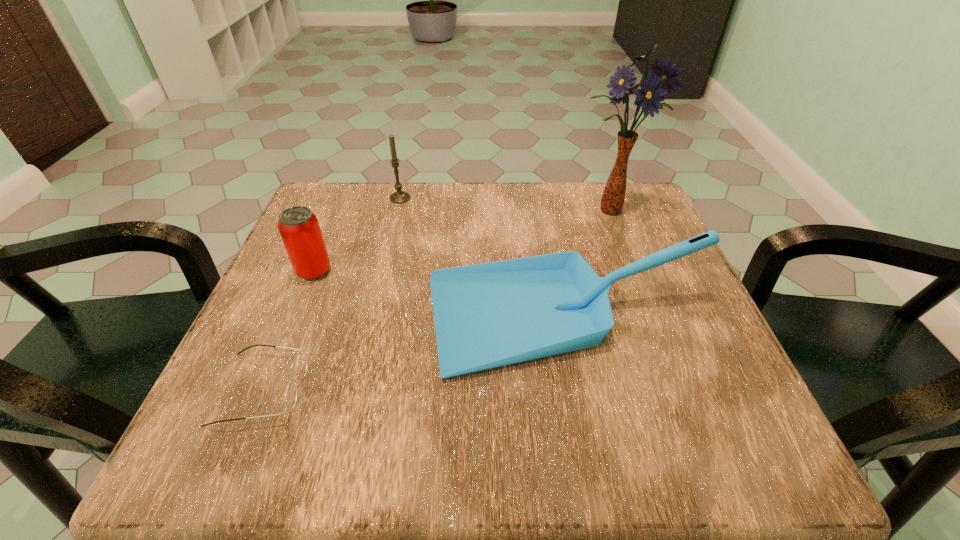
Where is `flower arrangement that is at the far edge`? The width and height of the screenshot is (960, 540). flower arrangement that is at the far edge is located at coordinates (649, 97).

Where is `candle present at the far edge`? The height and width of the screenshot is (540, 960). candle present at the far edge is located at coordinates (399, 196).

Where is `object that is at the near edge`? The image size is (960, 540). object that is at the near edge is located at coordinates (291, 393).

Locate an element on the screen. can that is at the left edge is located at coordinates (299, 228).

Image resolution: width=960 pixels, height=540 pixels. Identify the location of spectacles present at the left edge. (291, 393).

You are a GUI agent. You are given a task and a screenshot of the screen. Output one action in this format:
    pyautogui.click(x=<x>, y=<y>)
    Task: Click on the flower arrangement situated at the right edge
    The height and width of the screenshot is (540, 960).
    Given the screenshot: What is the action you would take?
    (649, 97)

I want to click on dustpan positioned at the right edge, so click(487, 315).

The width and height of the screenshot is (960, 540). What are the coordinates of `object at the near left corner` in the screenshot? It's located at (291, 393).

You are a GUI agent. You are given a task and a screenshot of the screen. Output one action in this format:
    pyautogui.click(x=<x>, y=<y>)
    Task: Click on the object that is at the far right corner
    The width and height of the screenshot is (960, 540).
    Given the screenshot: What is the action you would take?
    pyautogui.click(x=649, y=97)

The height and width of the screenshot is (540, 960). In order to click on blank space at the far edge of the desktop in this screenshot , I will do `click(475, 225)`.